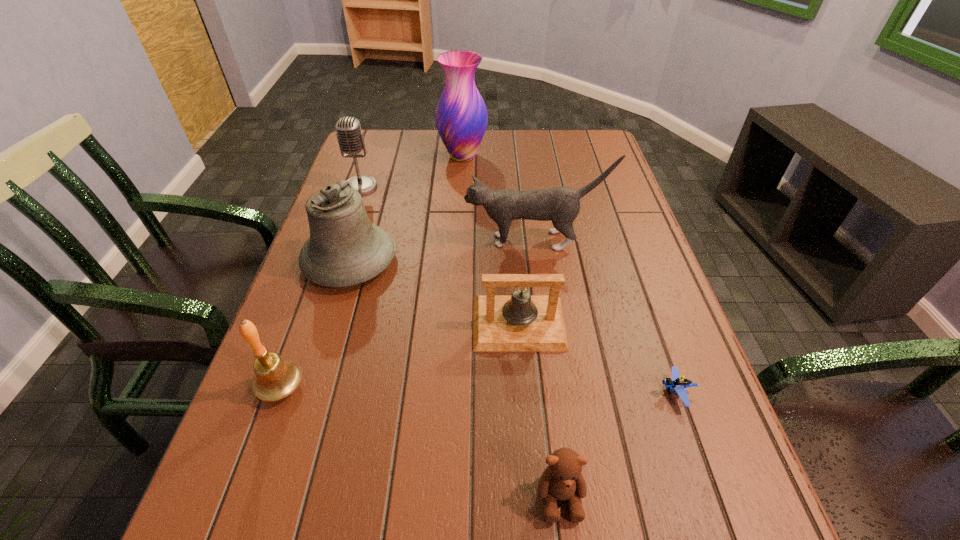
This screenshot has height=540, width=960. What are the coordinates of `the tallest object` in the screenshot? It's located at (461, 118).

You are a GUI agent. You are given a task and a screenshot of the screen. Output one action in this format:
    pyautogui.click(x=<x>, y=<y>)
    Task: Click on the farthest object
    
    Given the screenshot: What is the action you would take?
    pyautogui.click(x=461, y=118)

This screenshot has height=540, width=960. I want to click on cat, so click(x=561, y=205).

I want to click on the farthest bell, so click(x=344, y=249).

Identify the location of the second farthest object. (350, 137).

Identify the location of the nearest bell. This screenshot has width=960, height=540. (275, 379).

At what (x,y) coordinates should I click in order to perform the action: click on the second nearest bell. Please return your answer as a coordinate pair (x, y). The width and height of the screenshot is (960, 540). Looking at the image, I should click on (520, 322).

Identify the location of the shortest bell. (520, 322).

Locate an element on the screen. the nearest object is located at coordinates (562, 480).

This screenshot has width=960, height=540. I want to click on teddy bear, so click(562, 480).